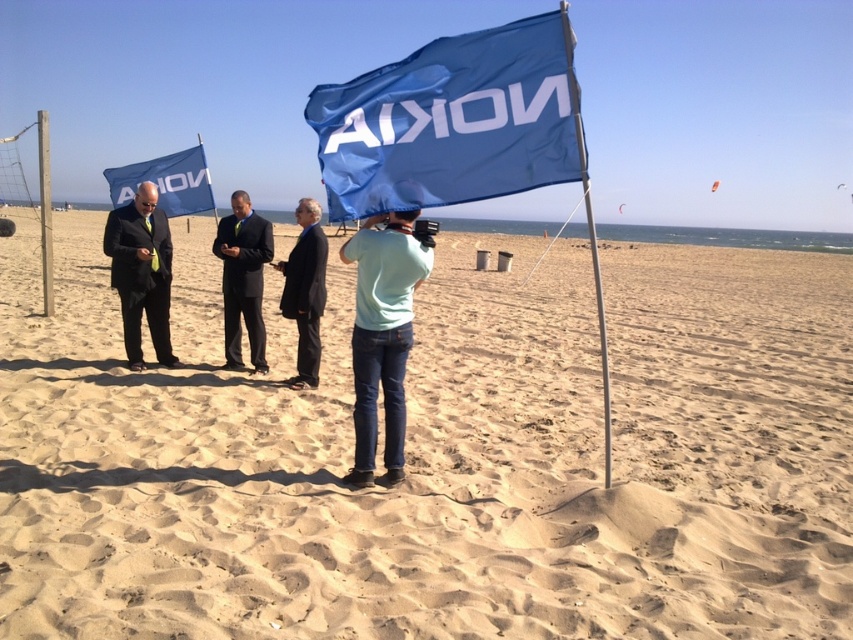
Question: Which point is farther from the camera taking this photo?

Choices:
 (A) (323, 237)
 (B) (610, 465)

Answer: (A)

Question: Can you confirm if dark blue suit at center is positioned to the left of black suit at center?

Choices:
 (A) no
 (B) yes

Answer: (B)

Question: In this image, where is sandy beach at center located relative to matte black suit at left?

Choices:
 (A) below
 (B) above

Answer: (B)

Question: Among these objects, which one is nearest to the camera?

Choices:
 (A) light blue cotton shirt at center
 (B) dark blue suit at center
 (C) metallic silver pole at left
 (D) blue fabric flag at center

Answer: (D)

Question: Which object is positioned farthest from the black suit at center?

Choices:
 (A) blue fabric flag at center
 (B) matte black suit at left
 (C) sandy beach at center
 (D) light blue cotton shirt at center

Answer: (C)

Question: Does sandy beach at center appear on the right side of matte black suit at left?

Choices:
 (A) yes
 (B) no

Answer: (B)